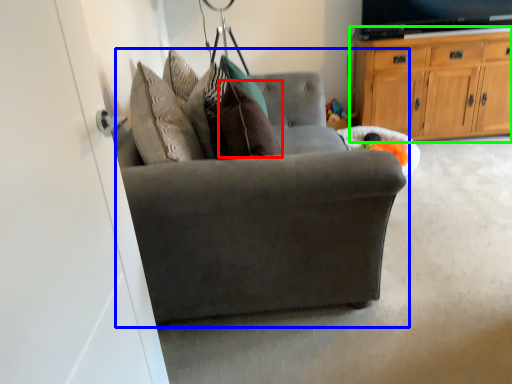
Question: Based on their relative distances, which object is farther from pillow (highlighted by a red box)? Choose from chair (highlighted by a blue box) and cabinetry (highlighted by a green box).

Choices:
 (A) chair
 (B) cabinetry

Answer: (B)